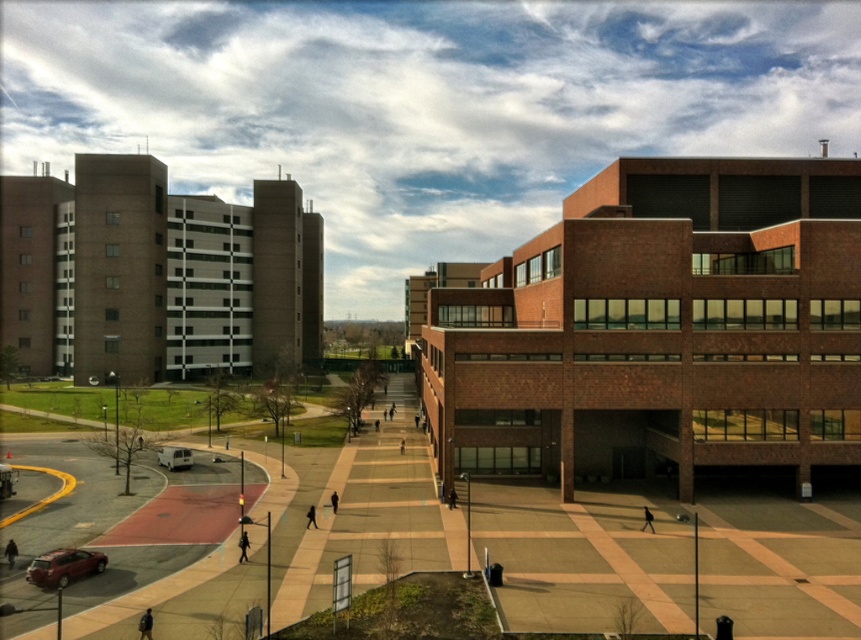
You are standing at the edge of the plaza in the image and want to walk towards the brick building on the right. There are two points marked on the plaza. Which point would you reach first as you walk towards the brick building? The points are point (536,461) and point (85,570).

You would reach point (85,570) first because point (536,461) is behind it. Since you are walking towards the brick building on the right, the point closer to your starting position would be encountered first.

You are a city planner analyzing the urban layout. Given the brick building at center and the white matte van at lower left, which object would cast a longer shadow during midday in this plaza?

The brick building at center is much taller than the white matte van at lower left, so it would cast a longer shadow during midday in the plaza.

You are a delivery person trying to park your vehicle in a tight space between the metallic red car at bottom left and the white matte van at lower left. Can you fit your delivery van, which is 2 meters tall, between them?

The metallic red car at bottom left is shorter than the white matte van at lower left. Since your delivery van is 2 meters tall, you should check the height of the space between them. If the lower of the two vehicles, the metallic red car at bottom left, is taller than 2 meters, then it might be possible. However, since the description states the metallic red car is shorter, but we don not have exact measurements, it is uncertain. Please verify the actual height on site.